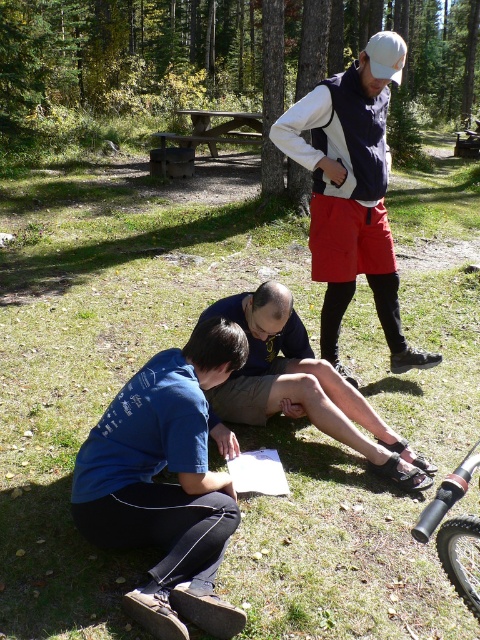
You are a hiker who wants to sit at the wooden picnic table at center. There is a person wearing a blue fabric shirt at lower left in your way. Can you walk around them to reach the picnic table?

The blue fabric shirt at lower left is in front of the wooden picnic table at center, so you can walk around them to reach the picnic table.

Looking at this image, you are planning to take a photo of the blue fabric shirt at lower center and the black matte mountain bike at lower right. Which object should you position on the left side of your photo to capture both in the frame?

The blue fabric shirt at lower center should be positioned on the left side of the photo since it is already to the left of the black matte mountain bike at lower right.

You are standing at the origin point of the coordinate system in the image. You need to locate the matte black vest at upper center. Which direction should you move to reach it?

The matte black vest at upper center is located at coordinate point 0.303 on the x axis and 0.733 on the y axis. Since you are at the origin point, you should move towards the positive x and positive y direction to reach it.